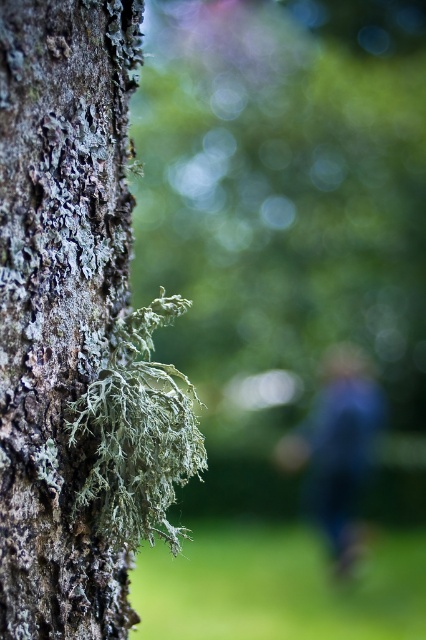
Is green mossy bark at left to the left of blue fabric at center from the viewer's perspective?

Correct, you'll find green mossy bark at left to the left of blue fabric at center.

The image size is (426, 640). What do you see at coordinates (60, 298) in the screenshot?
I see `green mossy bark at left` at bounding box center [60, 298].

The height and width of the screenshot is (640, 426). In order to click on green mossy bark at left in this screenshot , I will do `click(60, 298)`.

What are the coordinates of `green mossy bark at left` in the screenshot? It's located at (60, 298).